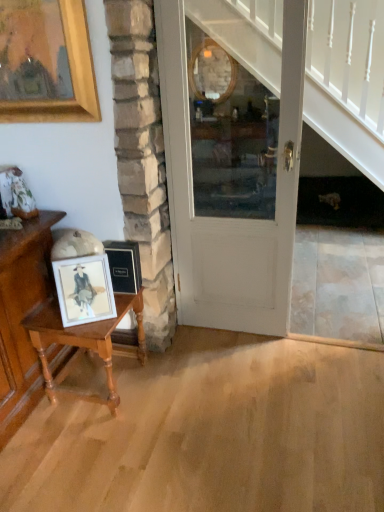
Question: Is matte wooden picture frame at left turned away from wooden table at left?

Choices:
 (A) yes
 (B) no

Answer: (B)

Question: Is matte wooden picture frame at left in front of wooden table at left?

Choices:
 (A) no
 (B) yes

Answer: (B)

Question: Does matte wooden picture frame at left turn towards wooden table at left?

Choices:
 (A) yes
 (B) no

Answer: (B)

Question: From the image's perspective, would you say matte wooden picture frame at left is positioned over wooden table at left?

Choices:
 (A) no
 (B) yes

Answer: (B)

Question: Does matte wooden picture frame at left have a lesser width compared to wooden table at left?

Choices:
 (A) no
 (B) yes

Answer: (B)

Question: From their relative heights in the image, would you say matte wooden picture frame at left is taller or shorter than wooden table at left?

Choices:
 (A) short
 (B) tall

Answer: (A)

Question: Considering the relative positions of matte wooden picture frame at left and wooden table at left in the image provided, is matte wooden picture frame at left to the left or to the right of wooden table at left?

Choices:
 (A) right
 (B) left

Answer: (A)

Question: Is matte wooden picture frame at left inside or outside of wooden table at left?

Choices:
 (A) outside
 (B) inside

Answer: (A)

Question: From the image's perspective, is matte wooden picture frame at left positioned above or below wooden table at left?

Choices:
 (A) above
 (B) below

Answer: (A)

Question: In terms of height, does wooden table at left look taller or shorter compared to white painted wood door at center?

Choices:
 (A) short
 (B) tall

Answer: (A)

Question: Considering the positions of wooden table at left and white painted wood door at center in the image, is wooden table at left bigger or smaller than white painted wood door at center?

Choices:
 (A) big
 (B) small

Answer: (B)

Question: Is wooden table at left wider or thinner than white painted wood door at center?

Choices:
 (A) thin
 (B) wide

Answer: (B)

Question: Is wooden table at left to the left or to the right of white painted wood door at center in the image?

Choices:
 (A) left
 (B) right

Answer: (A)

Question: From a real-world perspective, is wooden table at left physically located above or below matte wooden picture frame at left?

Choices:
 (A) above
 (B) below

Answer: (B)

Question: From their relative heights in the image, would you say wooden table at left is taller or shorter than matte wooden picture frame at left?

Choices:
 (A) short
 (B) tall

Answer: (B)